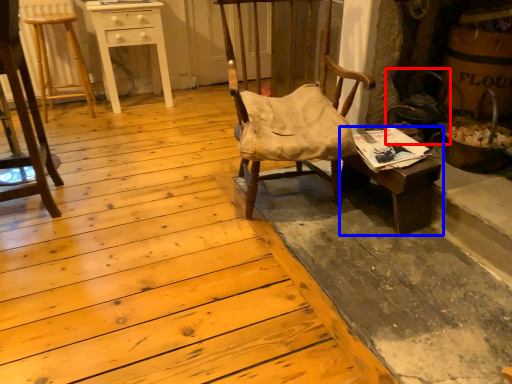
Question: Which of the following is the farthest to the observer, swivel chair (highlighted by a red box) or desk (highlighted by a blue box)?

Choices:
 (A) swivel chair
 (B) desk

Answer: (A)